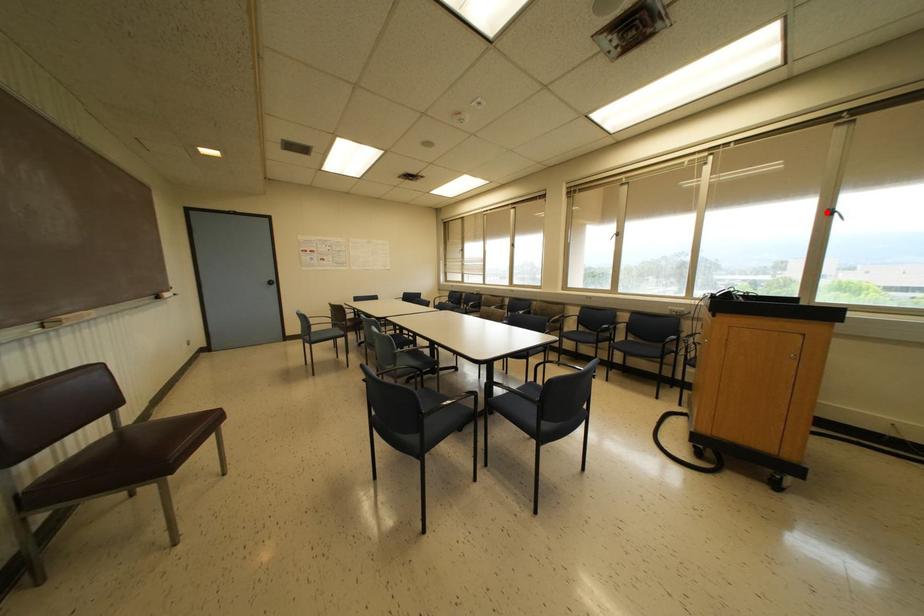
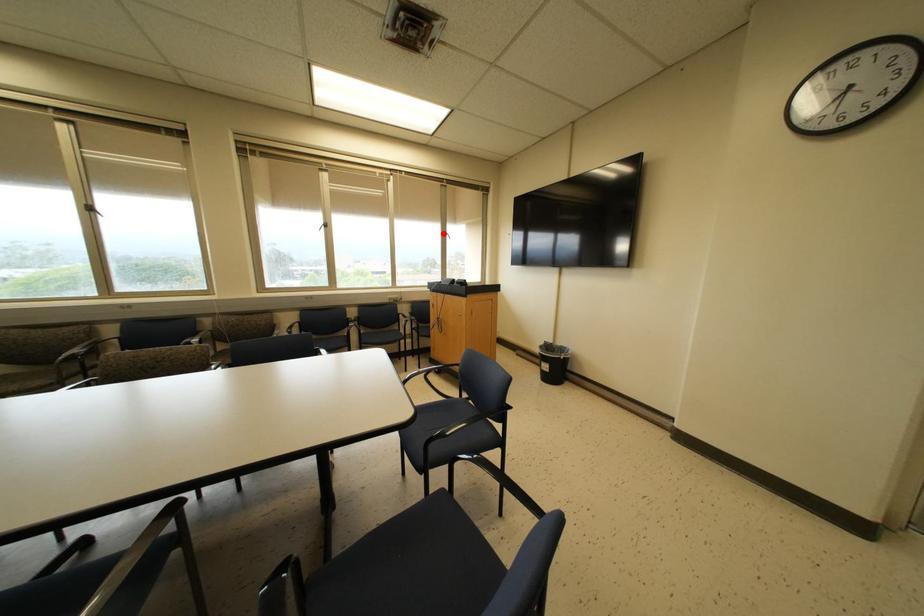
I am providing you with two images of the same scene from different viewpoints. A red point is marked on the first image and another point is marked on the second image. Is the red point in image1 aligned with the point shown in image2?

Yes